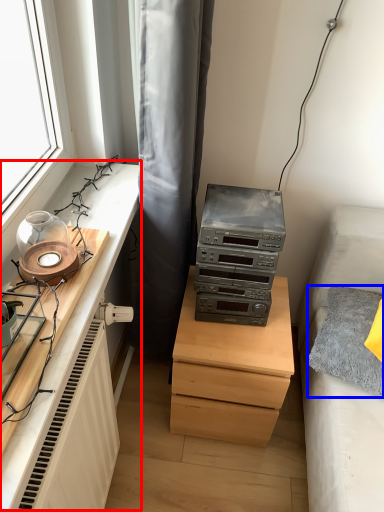
Question: Which point is closer to the camera, entertainment center (highlighted by a red box) or pillow (highlighted by a blue box)?

Choices:
 (A) entertainment center
 (B) pillow

Answer: (A)